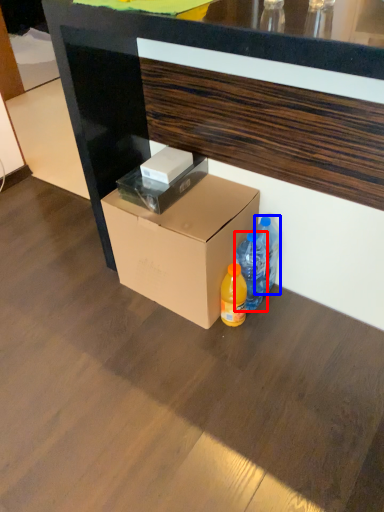
Question: Which object is closer to the camera taking this photo, bottle (highlighted by a red box) or bottle (highlighted by a blue box)?

Choices:
 (A) bottle
 (B) bottle

Answer: (A)